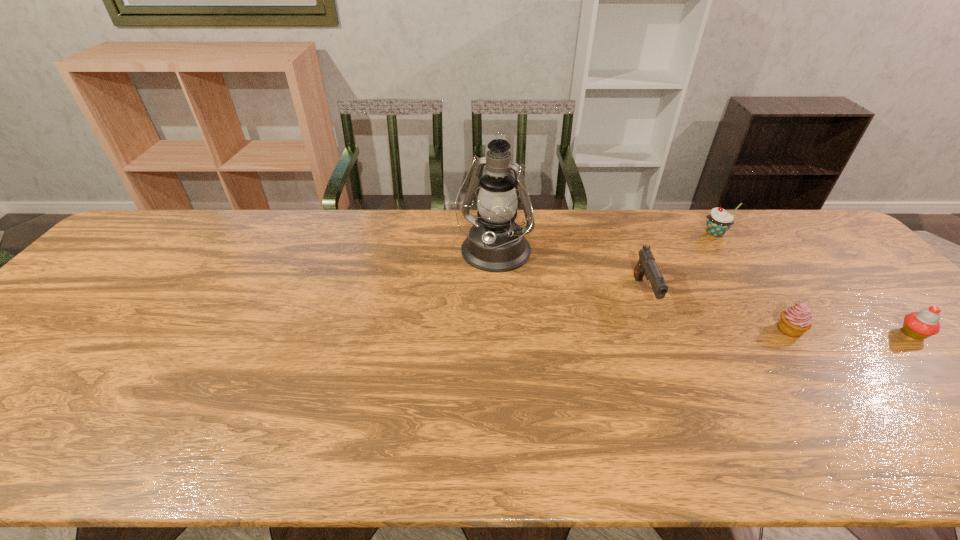
The height and width of the screenshot is (540, 960). What are the coordinates of `vacant space that's between the second object from left to right and the rightmost object` in the screenshot? It's located at (779, 314).

Locate which object ranks third in proximity to the tallest cupcake. Please provide its 2D coordinates. Your answer should be formatted as a tuple, i.e. [(x, y)], where the tuple contains the x and y coordinates of a point satisfying the conditions above.

[(920, 325)]

Locate which object ranks third in proximity to the fourth object from right to left. Please provide its 2D coordinates. Your answer should be formatted as a tuple, i.e. [(x, y)], where the tuple contains the x and y coordinates of a point satisfying the conditions above.

[(719, 221)]

I want to click on cupcake that is the closest one to the gun, so click(x=796, y=320).

The width and height of the screenshot is (960, 540). I want to click on cupcake that can be found as the second closest to the farthest cupcake, so click(x=920, y=325).

Image resolution: width=960 pixels, height=540 pixels. In order to click on vacant region that satisfies the following two spatial constraints: 1. in the direction the gun is aimed; 2. on the left side of the rightmost cupcake in this screenshot , I will do `click(660, 334)`.

At what (x,y) coordinates should I click in order to perform the action: click on free space in the image that satisfies the following two spatial constraints: 1. in the direction the fourth object from right to left is aimed; 2. on the left side of the rightmost cupcake. Please return your answer as a coordinate pair (x, y). Looking at the image, I should click on (660, 334).